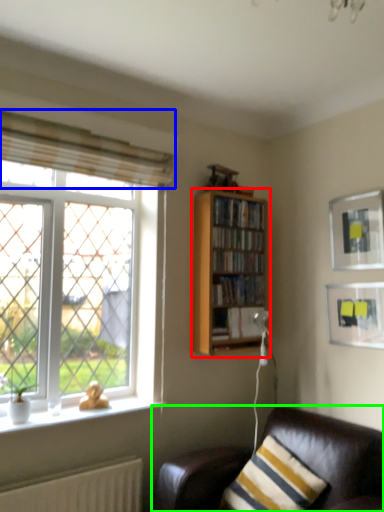
Question: Which object is positioned farthest from bookcase (highlighted by a red box)? Select from curtain (highlighted by a blue box) and studio couch (highlighted by a green box).

Choices:
 (A) curtain
 (B) studio couch

Answer: (B)